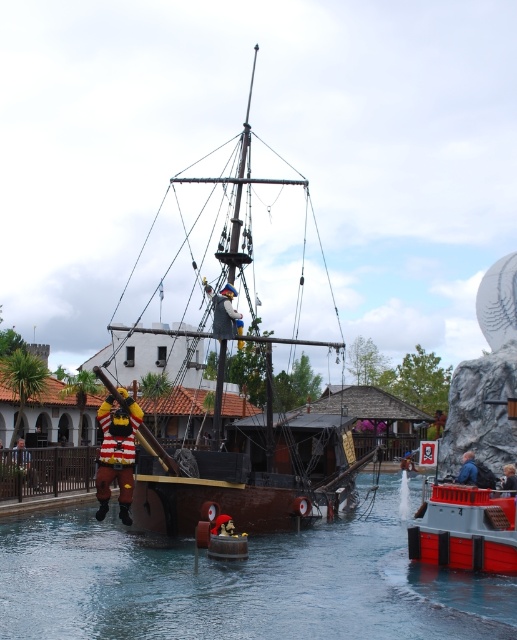
Is point (180, 563) positioned in front of point (194, 513)?

Yes.

At what (x,y) coordinates should I click in order to perform the action: click on brown wooden waterway at center. Please return your answer as a coordinate pair (x, y). Looking at the image, I should click on click(241, 582).